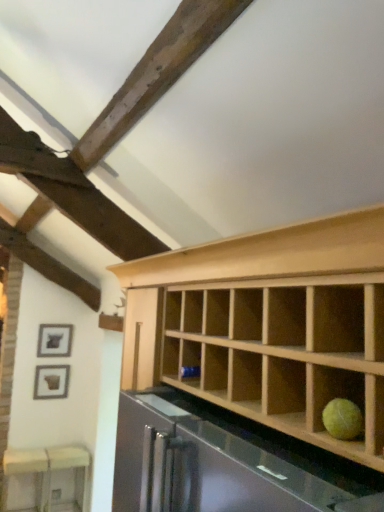
Question: From a real-world perspective, is white glossy table at lower left positioned above or below matte black picture frame at lower left, the 2th picture frame when ordered from top to bottom?

Choices:
 (A) below
 (B) above

Answer: (A)

Question: Is white glossy table at lower left spatially inside matte black picture frame at lower left, which ranks as the 1th picture frame in bottom-to-top order, or outside of it?

Choices:
 (A) outside
 (B) inside

Answer: (A)

Question: Estimate the real-world distances between objects in this image. Which object is closer to the matte black picture frame at upper left, the second picture frame from the bottom?

Choices:
 (A) matte black picture frame at lower left, which ranks as the 1th picture frame in bottom-to-top order
 (B) white glossy table at lower left

Answer: (A)

Question: Which of these objects is positioned closest to the matte black picture frame at lower left, which ranks as the 1th picture frame in bottom-to-top order?

Choices:
 (A) white glossy table at lower left
 (B) matte black picture frame at upper left, the second picture frame from the bottom

Answer: (B)